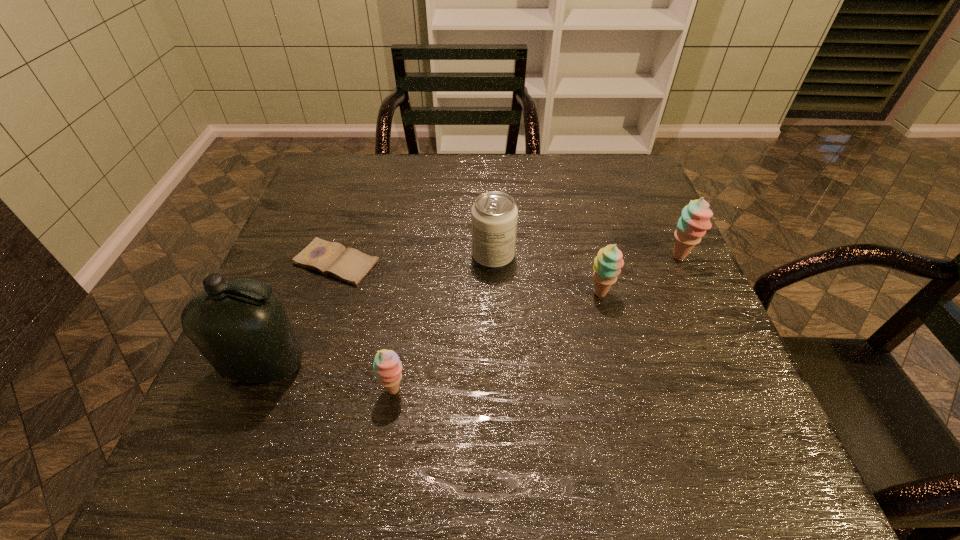
Where is `object located at the near left corner`? object located at the near left corner is located at coordinates (240, 326).

This screenshot has width=960, height=540. In order to click on vacant space at the far edge of the desktop in this screenshot , I will do `click(402, 163)`.

At what (x,y) coordinates should I click in order to perform the action: click on free space at the near edge of the desktop. Please return your answer as a coordinate pair (x, y). This screenshot has height=540, width=960. Looking at the image, I should click on (538, 382).

Find the location of a particular element. free region at the left edge of the desktop is located at coordinates (324, 311).

Identify the location of vacant area at the right edge. The image size is (960, 540). (706, 366).

I want to click on free point at the far left corner, so click(x=331, y=193).

In the image, there is a desktop. Identify the location of free space at the far right corner. This screenshot has height=540, width=960. (636, 180).

Locate an element on the screen. vacant space that's between the shortest object and the second farthest sherbert is located at coordinates (468, 279).

This screenshot has width=960, height=540. I want to click on vacant area that lies between the soda can and the nearest sherbert, so click(x=444, y=323).

Locate an element on the screen. The height and width of the screenshot is (540, 960). free spot between the second shortest object and the shortest object is located at coordinates (366, 327).